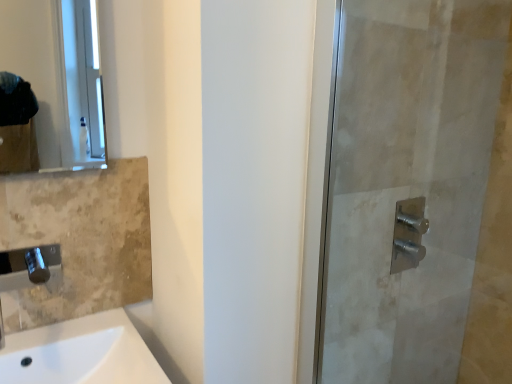
Where is `satin nickel faucet at right`? satin nickel faucet at right is located at coordinates (408, 234).

The image size is (512, 384). Identify the location of satin nickel shower handle at right. (419, 194).

In order to click on polished chrome faucet at lower left in this screenshot , I will do 28,266.

Locate an element on the screen. satin nickel faucet at right is located at coordinates (408, 234).

Is there a large distance between matte glass mirror at upper left and satin nickel faucet at right?

Yes, matte glass mirror at upper left and satin nickel faucet at right are quite far apart.

Would you say matte glass mirror at upper left is outside satin nickel faucet at right?

Yes, matte glass mirror at upper left is outside of satin nickel faucet at right.

Which is in front, matte glass mirror at upper left or satin nickel faucet at right?

matte glass mirror at upper left is in front.

Considering the relative sizes of matte glass mirror at upper left and satin nickel faucet at right in the image provided, is matte glass mirror at upper left smaller than satin nickel faucet at right?

Actually, matte glass mirror at upper left might be larger than satin nickel faucet at right.

The height and width of the screenshot is (384, 512). I want to click on screen door below the matte glass mirror at upper left (from a real-world perspective), so click(419, 194).

Which object is positioned more to the right, matte glass mirror at upper left or satin nickel shower handle at right?

Positioned to the right is satin nickel shower handle at right.

Considering the relative positions of matte glass mirror at upper left and satin nickel shower handle at right in the image provided, is matte glass mirror at upper left behind satin nickel shower handle at right?

No.

Based on the photo, can you confirm if polished chrome faucet at lower left is smaller than matte glass mirror at upper left?

No.

Identify the location of faucet on the left of matte glass mirror at upper left. Image resolution: width=512 pixels, height=384 pixels. (28, 266).

From the image's perspective, which one is positioned lower, polished chrome faucet at lower left or matte glass mirror at upper left?

polished chrome faucet at lower left, from the image's perspective.

From the image's perspective, would you say white ceramic sink at lower left is shown under satin nickel faucet at right?

Correct, white ceramic sink at lower left appears lower than satin nickel faucet at right in the image.

Can you confirm if white ceramic sink at lower left is shorter than satin nickel faucet at right?

No, white ceramic sink at lower left is not shorter than satin nickel faucet at right.

Is white ceramic sink at lower left inside the boundaries of satin nickel faucet at right, or outside?

white ceramic sink at lower left exists outside the volume of satin nickel faucet at right.

Is white ceramic sink at lower left shorter than satin nickel shower handle at right?

Yes.

Does white ceramic sink at lower left turn towards satin nickel shower handle at right?

No, white ceramic sink at lower left is not turned towards satin nickel shower handle at right.

From the image's perspective, is white ceramic sink at lower left above satin nickel shower handle at right?

No, from the image's perspective, white ceramic sink at lower left is not on top of satin nickel shower handle at right.

How distant is white ceramic sink at lower left from satin nickel shower handle at right?

A distance of 30.67 inches exists between white ceramic sink at lower left and satin nickel shower handle at right.

From the image's perspective, does satin nickel faucet at right appear higher than polished chrome faucet at lower left?

Yes, from the image's perspective, satin nickel faucet at right is on top of polished chrome faucet at lower left.

Are satin nickel faucet at right and polished chrome faucet at lower left located far from each other?

No, satin nickel faucet at right is in close proximity to polished chrome faucet at lower left.

Is satin nickel faucet at right positioned with its back to polished chrome faucet at lower left?

That's not correct — satin nickel faucet at right is not looking away from polished chrome faucet at lower left.

Can we say satin nickel shower handle at right lies outside white ceramic sink at lower left?

Yes, satin nickel shower handle at right is outside of white ceramic sink at lower left.

From a real-world perspective, is satin nickel shower handle at right positioned under white ceramic sink at lower left based on gravity?

No, from a real-world perspective, satin nickel shower handle at right is not under white ceramic sink at lower left.

From the picture: How different are the orientations of satin nickel shower handle at right and white ceramic sink at lower left in degrees?

The angular difference between satin nickel shower handle at right and white ceramic sink at lower left is 1.53 degrees.

Is satin nickel shower handle at right bigger than white ceramic sink at lower left?

Indeed, satin nickel shower handle at right has a larger size compared to white ceramic sink at lower left.

You are a GUI agent. You are given a task and a screenshot of the screen. Output one action in this format:
    pyautogui.click(x=<x>, y=<y>)
    Task: Click on the shower that is on the right side of matte glass mirror at upper left
    The width and height of the screenshot is (512, 384).
    Given the screenshot: What is the action you would take?
    pyautogui.click(x=408, y=234)

In order to click on mirror on the left of satin nickel shower handle at right in this screenshot , I will do `click(54, 85)`.

Estimate the real-world distances between objects in this image. Which object is further from polished chrome faucet at lower left, satin nickel faucet at right or satin nickel shower handle at right?

The object further to polished chrome faucet at lower left is satin nickel shower handle at right.

Which object lies nearer to the anchor point matte glass mirror at upper left, satin nickel faucet at right or satin nickel shower handle at right?

Among the two, satin nickel shower handle at right is located nearer to matte glass mirror at upper left.

Looking at the image, which one is located further to white ceramic sink at lower left, matte glass mirror at upper left or satin nickel shower handle at right?

Based on the image, matte glass mirror at upper left appears to be further to white ceramic sink at lower left.

Which object lies nearer to the anchor point polished chrome faucet at lower left, white ceramic sink at lower left or satin nickel faucet at right?

Based on the image, white ceramic sink at lower left appears to be nearer to polished chrome faucet at lower left.

When comparing their distances from white ceramic sink at lower left, does satin nickel faucet at right or polished chrome faucet at lower left seem closer?

polished chrome faucet at lower left is positioned closer to the anchor white ceramic sink at lower left.

From the image, which object appears to be farther from matte glass mirror at upper left, white ceramic sink at lower left or polished chrome faucet at lower left?

polished chrome faucet at lower left is positioned further to the anchor matte glass mirror at upper left.

Considering their positions, is satin nickel shower handle at right positioned closer to satin nickel faucet at right than polished chrome faucet at lower left?

satin nickel shower handle at right.

Considering their positions, is satin nickel faucet at right positioned further to satin nickel shower handle at right than polished chrome faucet at lower left?

polished chrome faucet at lower left is positioned further to the anchor satin nickel shower handle at right.

Identify the location of mirror located between polished chrome faucet at lower left and satin nickel shower handle at right in the left-right direction. This screenshot has height=384, width=512. coord(54,85).

At what (x,y) coordinates should I click in order to perform the action: click on mirror between polished chrome faucet at lower left and satin nickel faucet at right in the horizontal direction. Please return your answer as a coordinate pair (x, y). The height and width of the screenshot is (384, 512). Looking at the image, I should click on (54, 85).

Locate an element on the screen. The height and width of the screenshot is (384, 512). screen door between white ceramic sink at lower left and satin nickel faucet at right is located at coordinates (419, 194).

At what (x,y) coordinates should I click in order to perform the action: click on faucet that lies between matte glass mirror at upper left and white ceramic sink at lower left from top to bottom. Please return your answer as a coordinate pair (x, y). This screenshot has height=384, width=512. Looking at the image, I should click on (28, 266).